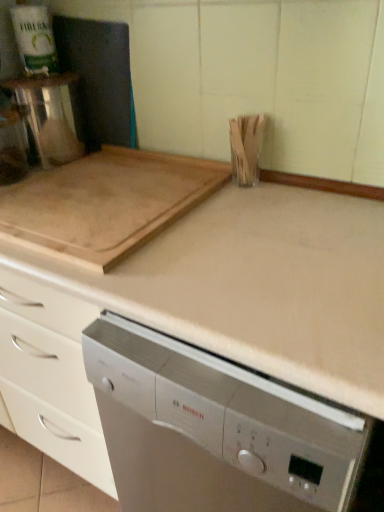
Identify the location of vacant point to the right of natural wood cutting board at upper left. Image resolution: width=384 pixels, height=512 pixels. (281, 226).